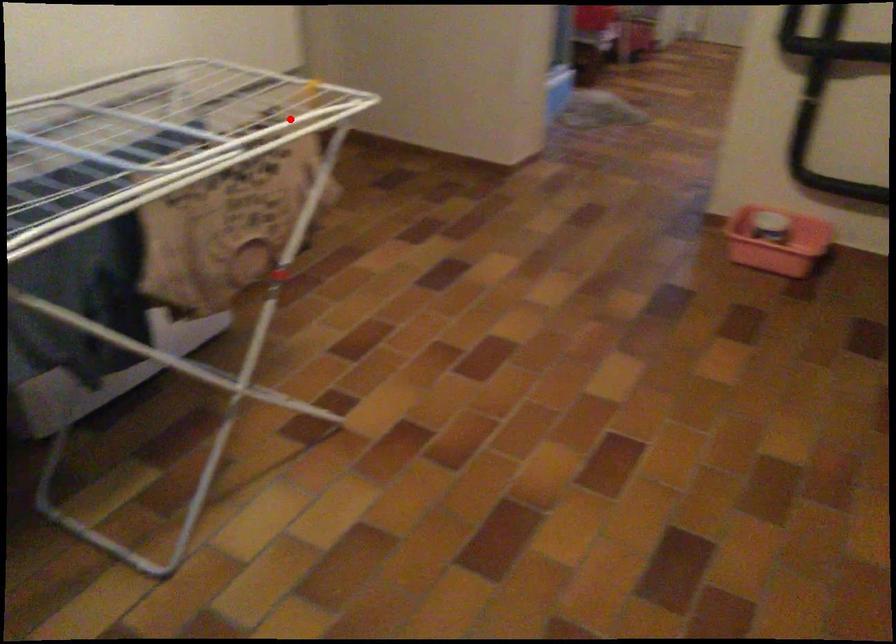
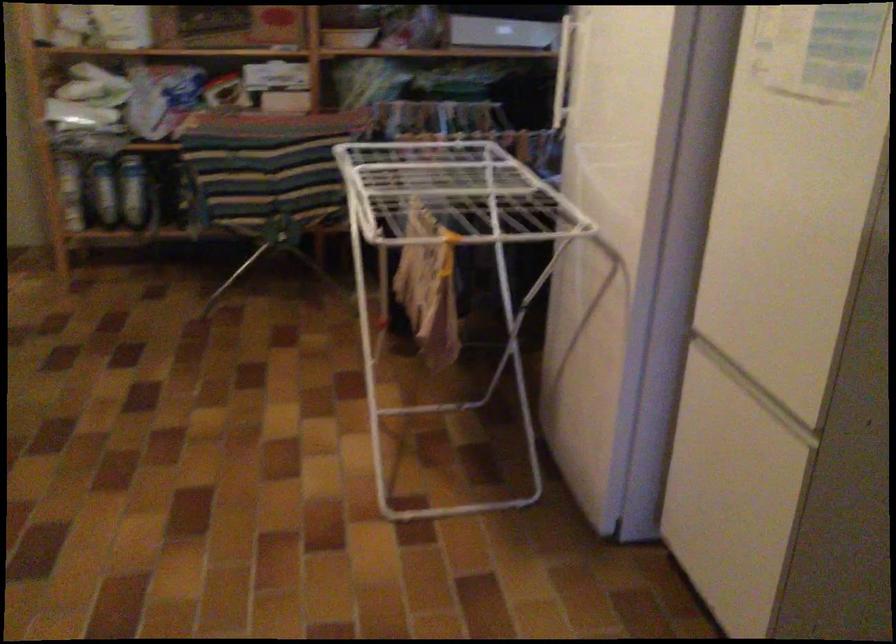
Where in the second image is the point corresponding to the highlighted location from the first image?

(450, 258)